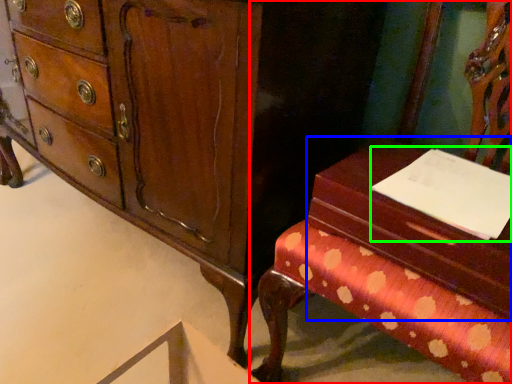
Question: Which is farther away from furniture (highlighted by a red box)? vanity (highlighted by a blue box) or notepad (highlighted by a green box)?

Choices:
 (A) vanity
 (B) notepad

Answer: (B)